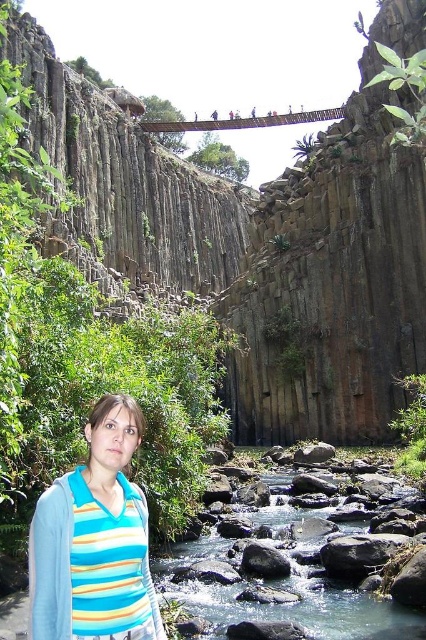
You are a hiker who wants to cross the clear water stream at center. You see the striped fabric at lower left. Which direction should you walk to reach the stream from the striped fabric?

The striped fabric at lower left is to the left of the clear water stream at center, so you should walk to the right to reach the stream from the striped fabric.